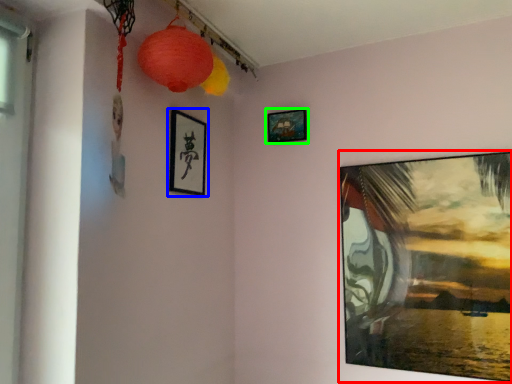
Question: Estimate the real-world distances between objects in this image. Which object is farther from picture frame (highlighted by a red box), picture frame (highlighted by a blue box) or picture frame (highlighted by a green box)?

Choices:
 (A) picture frame
 (B) picture frame

Answer: (A)